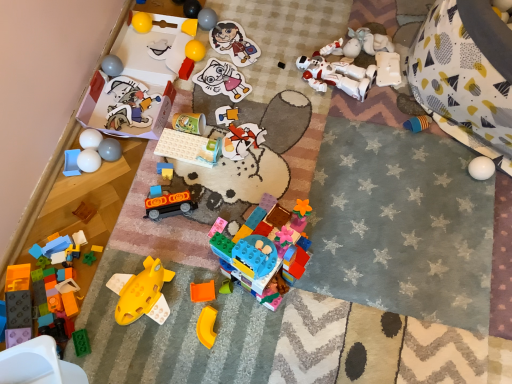
The width and height of the screenshot is (512, 384). Identify the location of free space that is in between white plastic robot at upper right, which appears as the second toy when viewed from the right, and smooth yellow ball at upper center, the ninth toy from the right. (277, 48).